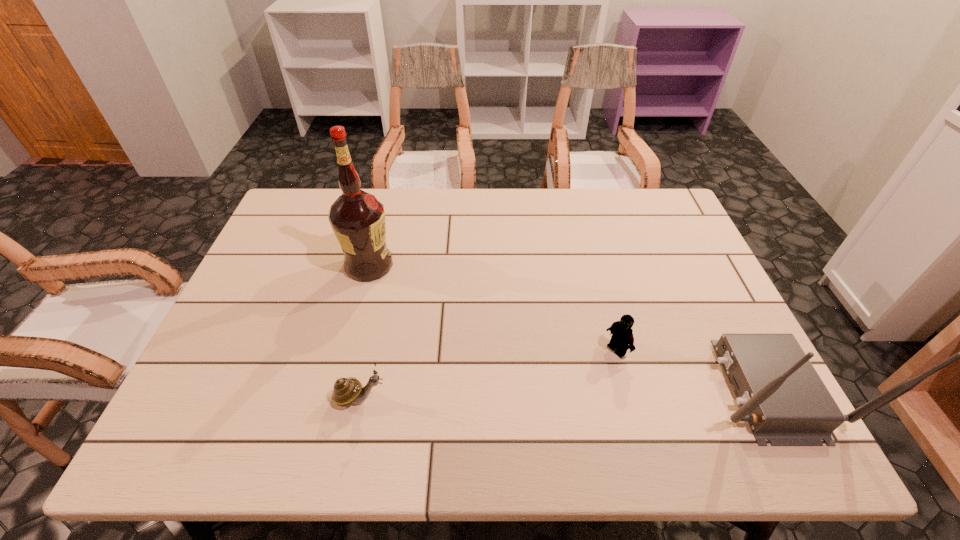
I want to click on free space on the desktop that is between the snail and the router and is positioned on the face of the Lego, so click(x=546, y=393).

The height and width of the screenshot is (540, 960). Identify the location of vacant space on the desktop that is between the snail and the rightmost object and is positioned on the label of the farthest object. (563, 393).